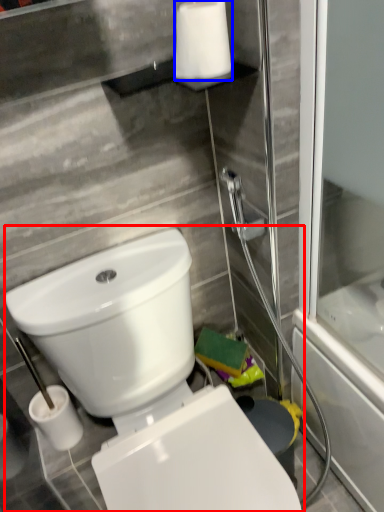
Question: Among these objects, which one is farthest to the camera, toilet (highlighted by a red box) or toilet paper (highlighted by a blue box)?

Choices:
 (A) toilet
 (B) toilet paper

Answer: (B)